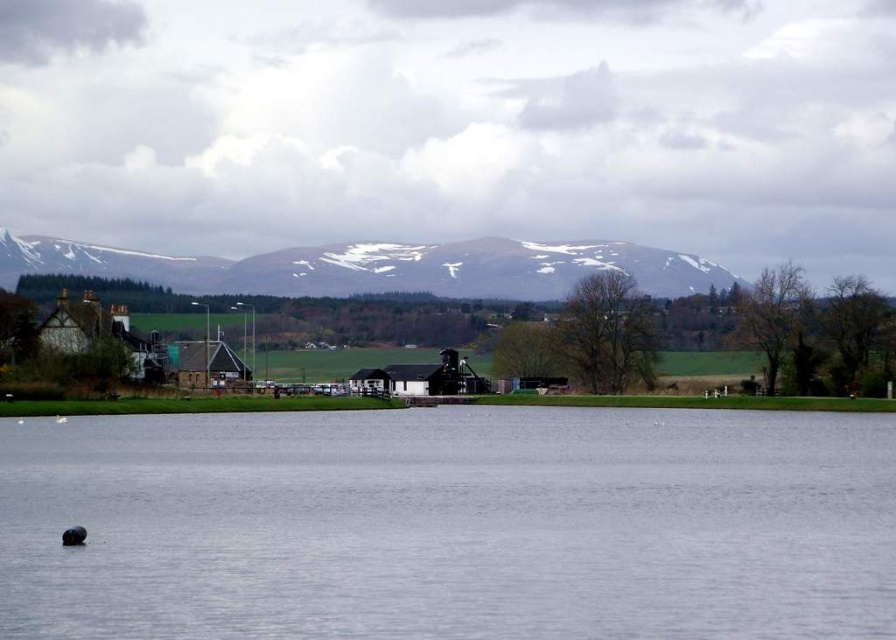
You are a hiker planning to cross the clear water at center. The snowy rock mountain at upper center is behind you. Which direction should you face to cross the water?

You should face downward to cross the clear water at center since the snowy rock mountain at upper center is behind you, indicating it is in the upper direction, so facing downward would orient you towards the water.